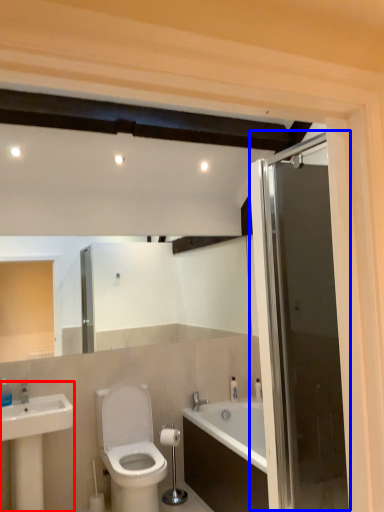
Question: Which object is closer to the camera taking this photo, sink (highlighted by a red box) or door (highlighted by a blue box)?

Choices:
 (A) sink
 (B) door

Answer: (B)